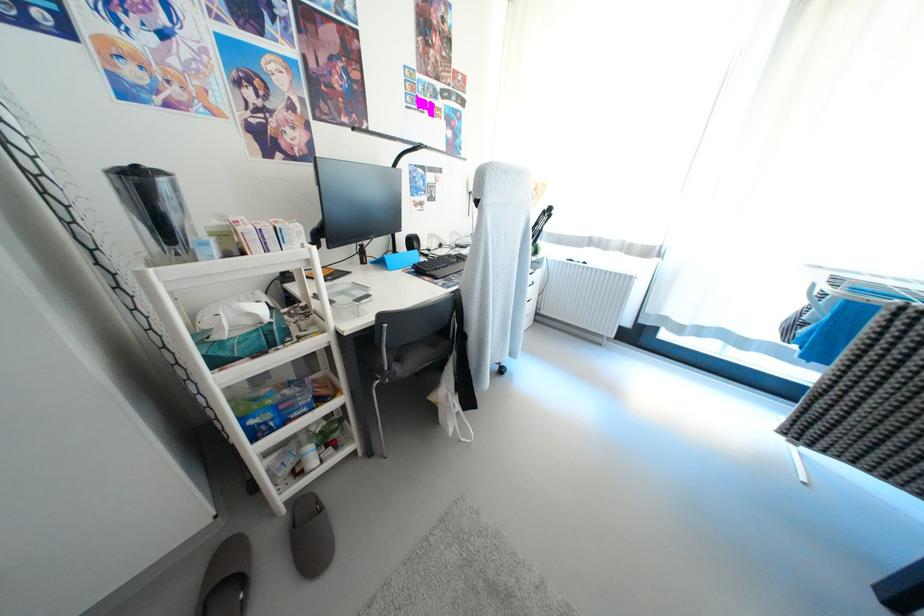
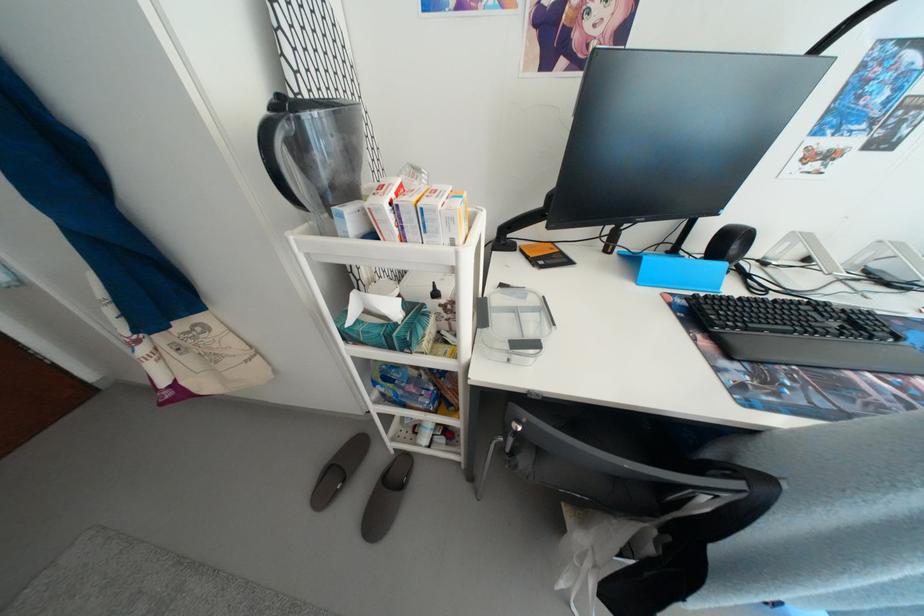
Based on the continuous images, in which direction is the camera rotating?

The camera rotated toward left-down.